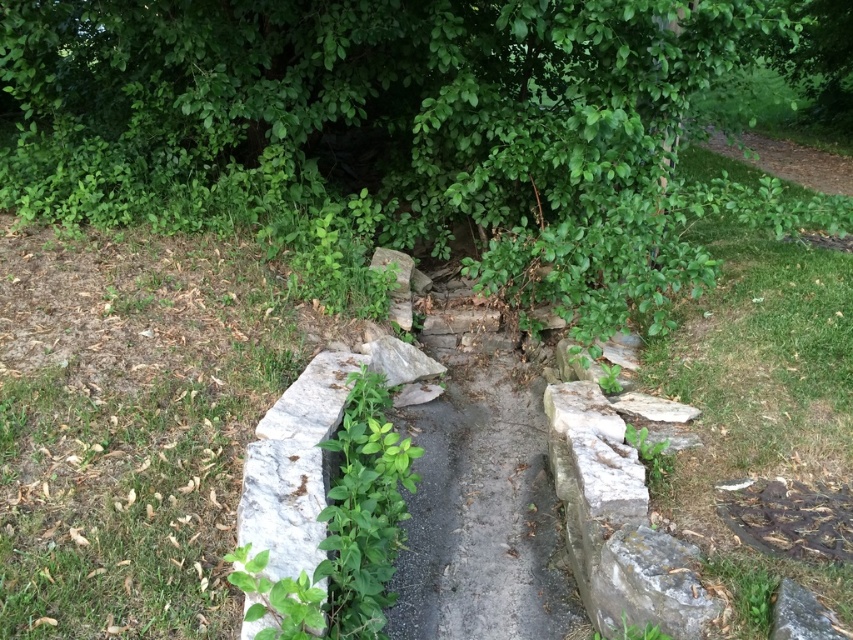
Question: Does gray stone path at center have a larger size compared to green leafy weed at center?

Choices:
 (A) yes
 (B) no

Answer: (A)

Question: Which point is farther to the camera?

Choices:
 (A) (450, 474)
 (B) (370, 410)
 (C) (351, 52)

Answer: (C)

Question: Among these points, which one is nearest to the camera?

Choices:
 (A) (498, 552)
 (B) (329, 428)

Answer: (B)

Question: Based on their relative distances, which object is nearer to the green leafy weed at center?

Choices:
 (A) green leafy tree at upper center
 (B) gray stone path at center

Answer: (B)

Question: Does gray stone path at center have a lesser width compared to green leafy weed at center?

Choices:
 (A) yes
 (B) no

Answer: (B)

Question: From the image, what is the correct spatial relationship of green leafy tree at upper center in relation to green leafy weed at center?

Choices:
 (A) above
 (B) below

Answer: (A)